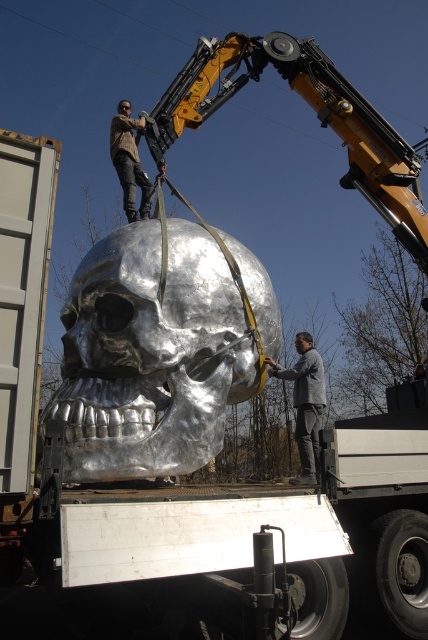
Question: Can you confirm if shiny metallic skull at center is positioned to the right of brown leather jacket at upper center?

Choices:
 (A) no
 (B) yes

Answer: (B)

Question: Which of the following is the farthest from the observer?

Choices:
 (A) [x=125, y=108]
 (B) [x=282, y=371]
 (C) [x=222, y=269]

Answer: (A)

Question: Is gray fabric jacket at right bigger than brown leather jacket at upper center?

Choices:
 (A) no
 (B) yes

Answer: (A)

Question: Estimate the real-world distances between objects in this image. Which object is farther from the shiny metallic skull at center?

Choices:
 (A) gray fabric jacket at right
 (B) brown leather jacket at upper center

Answer: (A)

Question: Which object is the closest to the shiny metallic skull at center?

Choices:
 (A) gray fabric jacket at right
 (B) brown leather jacket at upper center

Answer: (B)

Question: Does shiny metallic skull at center lie behind brown leather jacket at upper center?

Choices:
 (A) yes
 (B) no

Answer: (B)